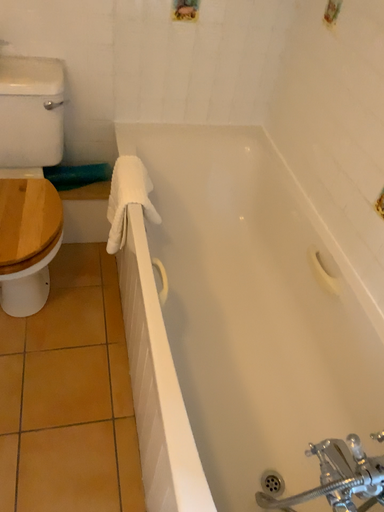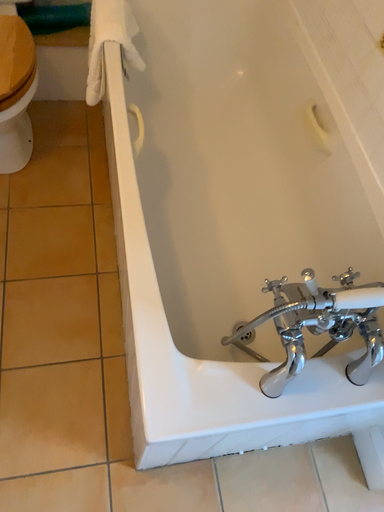
Question: Which way did the camera rotate in the video?

Choices:
 (A) rotated downward
 (B) rotated upward

Answer: (A)